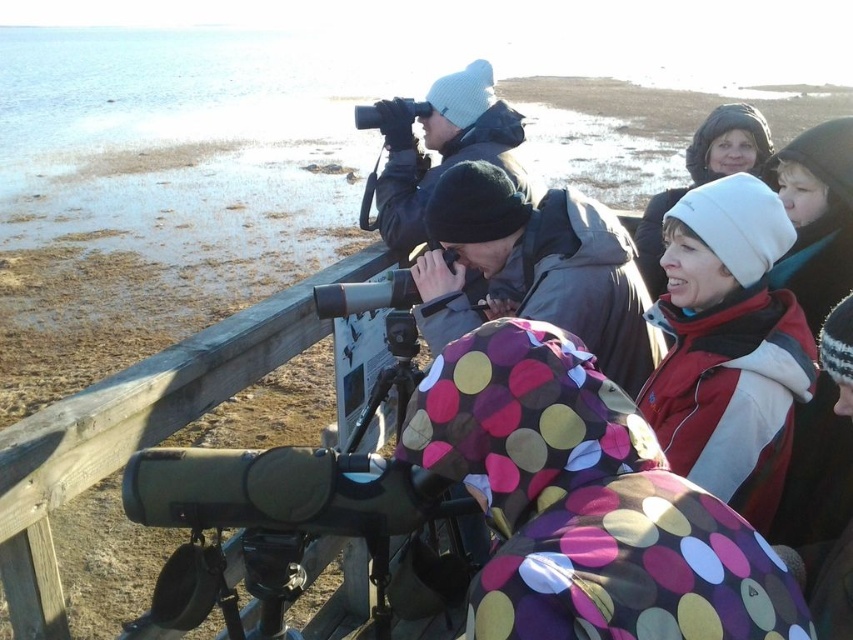
Does white fleece jacket at upper right have a lesser height compared to polka dot coat at center?

Incorrect, white fleece jacket at upper right's height does not fall short of polka dot coat at center's.

The height and width of the screenshot is (640, 853). Describe the element at coordinates (728, 346) in the screenshot. I see `white fleece jacket at upper right` at that location.

You are a GUI agent. You are given a task and a screenshot of the screen. Output one action in this format:
    pyautogui.click(x=<x>, y=<y>)
    Task: Click on the white fleece jacket at upper right
    Image resolution: width=853 pixels, height=640 pixels.
    Given the screenshot: What is the action you would take?
    (728, 346)

Does polka dot fabric at center lie in front of white fleece jacket at upper right?

Yes, it is in front of white fleece jacket at upper right.

Can you confirm if polka dot fabric at center is positioned to the left of white fleece jacket at upper right?

Correct, you'll find polka dot fabric at center to the left of white fleece jacket at upper right.

Where is `polka dot fabric at center`? polka dot fabric at center is located at coordinates (585, 502).

Does matte black binoculars at upper center appear under white fleece hat at upper center?

Indeed, matte black binoculars at upper center is positioned under white fleece hat at upper center.

In the scene shown: Who is positioned more to the left, matte black binoculars at upper center or white fleece hat at upper center?

matte black binoculars at upper center

Between point (415, 212) and point (636, 234), which one is positioned behind?

Point (636, 234)

The image size is (853, 640). Identify the location of matte black binoculars at upper center. (440, 148).